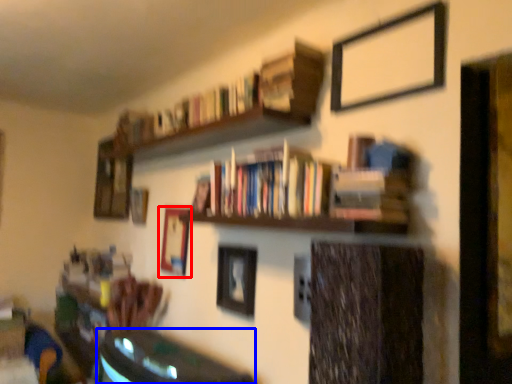
Question: Which object is further to the camera taking this photo, picture frame (highlighted by a red box) or table (highlighted by a blue box)?

Choices:
 (A) picture frame
 (B) table

Answer: (A)